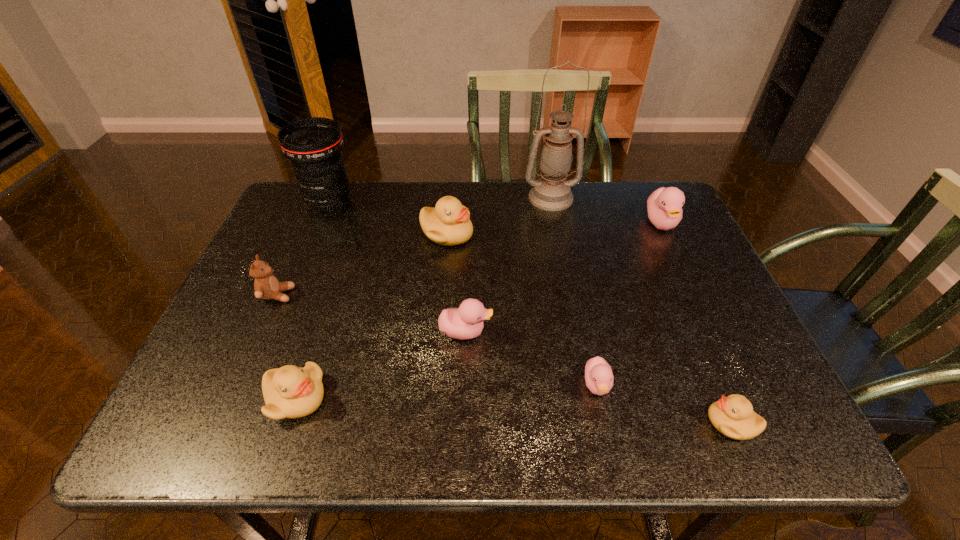
The image size is (960, 540). I want to click on gray oil lamp, so click(552, 192).

Where is `oil lamp`? oil lamp is located at coordinates (552, 192).

Image resolution: width=960 pixels, height=540 pixels. I want to click on the second tallest object, so click(x=314, y=145).

In order to click on telephoto lens in this screenshot , I will do `click(314, 145)`.

The image size is (960, 540). Find the location of `the farthest pink duckling`. the farthest pink duckling is located at coordinates (664, 206).

This screenshot has height=540, width=960. I want to click on the rightmost pink duckling, so click(664, 206).

Find the location of a particular element. the second yellow duckling from right to left is located at coordinates point(449,223).

Identify the location of the biggest yellow duckling. click(449, 223).

This screenshot has width=960, height=540. Find the location of `brown teddy bear`. brown teddy bear is located at coordinates (266, 286).

This screenshot has width=960, height=540. What are the coordinates of `the fifth farthest object` in the screenshot? It's located at (266, 286).